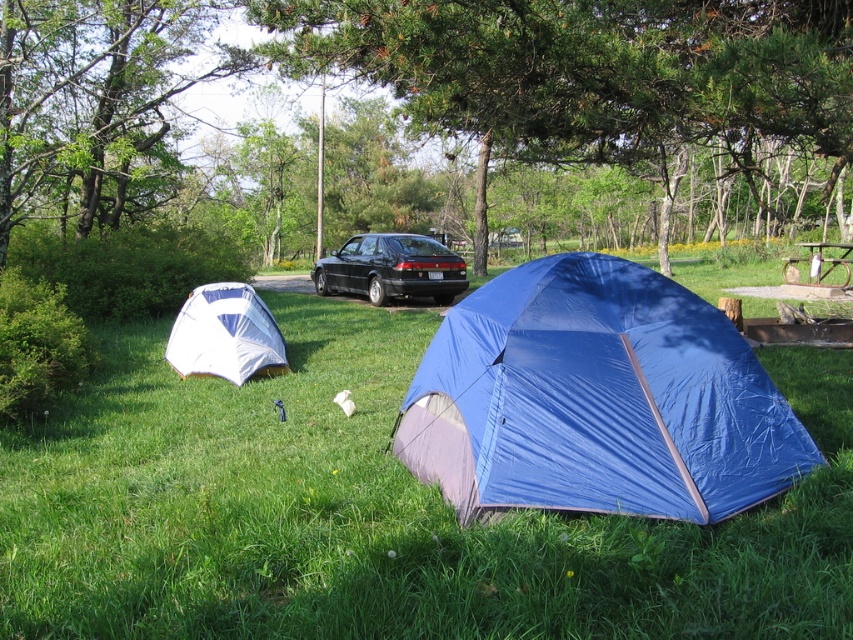
Question: Considering the real-world distances, which object is closest to the blue tarpaulin tent at center?

Choices:
 (A) black matte car at center
 (B) green leafy tree at upper center
 (C) rustic wood picnic table at center
 (D) blue fabric tent at center

Answer: (D)

Question: Does blue fabric tent at center appear under green leafy tree at upper center?

Choices:
 (A) yes
 (B) no

Answer: (A)

Question: Among these objects, which one is farthest from the camera?

Choices:
 (A) white/blue fabric tent at lower left
 (B) black matte car at center
 (C) blue tarpaulin tent at center

Answer: (B)

Question: Is green leafy tree at upper left above white/blue fabric tent at lower left?

Choices:
 (A) no
 (B) yes

Answer: (B)

Question: Which of the following is the closest to the observer?

Choices:
 (A) green leafy tree at upper left
 (B) blue fabric tent at center
 (C) green leafy tree at upper center
 (D) rustic wood picnic table at center

Answer: (B)

Question: Can you confirm if green leafy tree at upper center is positioned above black matte car at center?

Choices:
 (A) yes
 (B) no

Answer: (A)